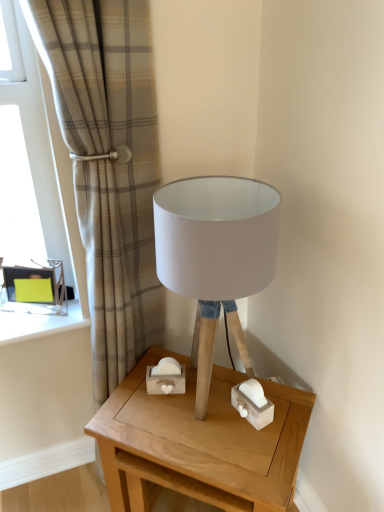
The width and height of the screenshot is (384, 512). Describe the element at coordinates (39, 324) in the screenshot. I see `green cardboard box at left` at that location.

Measure the distance between green cardboard box at left and camera.

green cardboard box at left and camera are 4.30 feet apart.

Locate an element on the screen. The width and height of the screenshot is (384, 512). wooden table at center is located at coordinates (198, 444).

What is the approximate height of beige plaid curtain at upper left?

The height of beige plaid curtain at upper left is 1.53 meters.

Find the location of a particular element. The image size is (384, 512). green cardboard box at left is located at coordinates (39, 324).

Is point (258, 199) closer or farther from the camera than point (182, 432)?

Clearly, point (258, 199) is closer to the camera than point (182, 432).

From the image's perspective, is white fabric lampshade at center beneath wooden table at center?

No.

Considering the sizes of objects white fabric lampshade at center and wooden table at center in the image provided, who is wider, white fabric lampshade at center or wooden table at center?

With larger width is wooden table at center.

How different are the orientations of wooden table at center and matte glass window at left in degrees?

The facing directions of wooden table at center and matte glass window at left are 45.1 degrees apart.

Between wooden table at center and matte glass window at left, which one has smaller size?

matte glass window at left is smaller.

From the image's perspective, between wooden table at center and matte glass window at left, which one is located above?

matte glass window at left.

In the scene shown: Could you tell me if wooden table at center is facing matte glass window at left?

No, wooden table at center is not aimed at matte glass window at left.

Considering the points (33, 167) and (93, 283), which point is behind, point (33, 167) or point (93, 283)?

The point (33, 167) is more distant.

From the picture: Considering the sizes of objects matte glass window at left and beige plaid curtain at upper left in the image provided, who is bigger, matte glass window at left or beige plaid curtain at upper left?

beige plaid curtain at upper left is bigger.

From a real-world perspective, relative to beige plaid curtain at upper left, is matte glass window at left vertically above or below?

matte glass window at left is situated higher than beige plaid curtain at upper left in the real world.

Is matte glass window at left not inside beige plaid curtain at upper left?

Yes.

Is green cardboard box at left looking in the opposite direction of wooden table at center?

green cardboard box at left is not turned away from wooden table at center.

Is point (75, 315) closer or farther from the camera than point (120, 458)?

Clearly, point (75, 315) is more distant from the camera than point (120, 458).

Does wooden table at center lie in front of white fabric lampshade at center?

No, wooden table at center is further to the viewer.

From a real-world perspective, is wooden table at center physically below white fabric lampshade at center?

Yes, from a real-world perspective, wooden table at center is below white fabric lampshade at center.

Is wooden table at center inside the boundaries of white fabric lampshade at center, or outside?

wooden table at center is not enclosed by white fabric lampshade at center.

Which of these two, wooden table at center or white fabric lampshade at center, is smaller?

Smaller between the two is white fabric lampshade at center.

Looking at their sizes, would you say white fabric lampshade at center is wider or thinner than beige plaid curtain at upper left?

In the image, white fabric lampshade at center appears to be wider than beige plaid curtain at upper left.

Can you tell me how much white fabric lampshade at center and beige plaid curtain at upper left differ in facing direction?

They differ by 45.3 degrees in their facing directions.

Can you confirm if white fabric lampshade at center is smaller than beige plaid curtain at upper left?

Yes.

From a real-world perspective, does white fabric lampshade at center stand above beige plaid curtain at upper left?

Yes, from a real-world perspective, white fabric lampshade at center is above beige plaid curtain at upper left.

Is matte glass window at left situated inside white fabric lampshade at center or outside?

matte glass window at left is located beyond the bounds of white fabric lampshade at center.

Between point (49, 328) and point (184, 212), which one is positioned in front?

The point (184, 212) is more forward.

Between matte glass window at left and white fabric lampshade at center, which one has larger width?

Result: With larger width is white fabric lampshade at center.

Where is `table behind the white fabric lampshade at center`? This screenshot has height=512, width=384. table behind the white fabric lampshade at center is located at coordinates (x=198, y=444).

The width and height of the screenshot is (384, 512). Find the location of `window that is above the wooden table at center (from the image's perspective)`. window that is above the wooden table at center (from the image's perspective) is located at coordinates (46, 190).

Based on their spatial positions, is wooden table at center or green cardboard box at left closer to white fabric lampshade at center?

wooden table at center is closer to white fabric lampshade at center.

Estimate the real-world distances between objects in this image. Which object is further from beige plaid curtain at upper left, green cardboard box at left or matte glass window at left?

green cardboard box at left.

From the image, which object appears to be farther from matte glass window at left, wooden table at center or beige plaid curtain at upper left?

wooden table at center is further to matte glass window at left.

From the image, which object appears to be nearer to green cardboard box at left, wooden table at center or white fabric lampshade at center?

wooden table at center.

Based on their spatial positions, is wooden table at center or white fabric lampshade at center further from matte glass window at left?

Among the two, wooden table at center is located further to matte glass window at left.

When comparing their distances from green cardboard box at left, does wooden table at center or matte glass window at left seem further?

wooden table at center is further to green cardboard box at left.

Considering their positions, is green cardboard box at left positioned further to matte glass window at left than beige plaid curtain at upper left?

green cardboard box at left is positioned further to the anchor matte glass window at left.

From the image, which object appears to be nearer to white fabric lampshade at center, beige plaid curtain at upper left or green cardboard box at left?

Among the two, beige plaid curtain at upper left is located nearer to white fabric lampshade at center.

The image size is (384, 512). What are the coordinates of `window sill between beige plaid curtain at upper left and wooden table at center in the up-down direction` in the screenshot? It's located at (39, 324).

Locate an element on the screen. table located between green cardboard box at left and white fabric lampshade at center in the left-right direction is located at coordinates (198, 444).

This screenshot has width=384, height=512. I want to click on curtain between matte glass window at left and wooden table at center from top to bottom, so pos(109,167).

Find the location of a particular element. curtain between matte glass window at left and green cardboard box at left in the up-down direction is located at coordinates (109, 167).